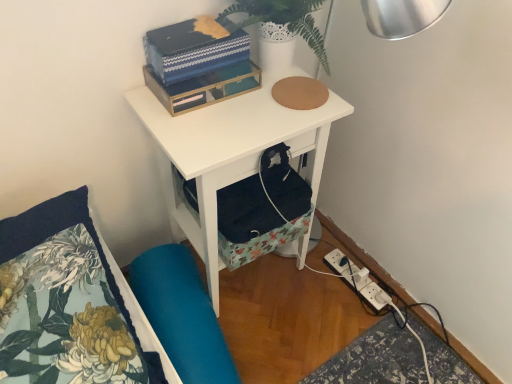
Question: Considering the relative positions of floral fabric pillow at lower left and blue textured box at upper center in the image provided, is floral fabric pillow at lower left to the right of blue textured box at upper center from the viewer's perspective?

Choices:
 (A) yes
 (B) no

Answer: (B)

Question: Does floral fabric pillow at lower left have a larger size compared to blue textured box at upper center?

Choices:
 (A) yes
 (B) no

Answer: (A)

Question: Is floral fabric pillow at lower left at the left side of blue textured box at upper center?

Choices:
 (A) yes
 (B) no

Answer: (A)

Question: Is blue textured box at upper center at the back of floral fabric pillow at lower left?

Choices:
 (A) yes
 (B) no

Answer: (B)

Question: Considering the relative sizes of floral fabric pillow at lower left and blue textured box at upper center in the image provided, is floral fabric pillow at lower left thinner than blue textured box at upper center?

Choices:
 (A) yes
 (B) no

Answer: (B)

Question: Is floral fabric pillow at lower left inside or outside of white textured vase at upper center?

Choices:
 (A) inside
 (B) outside

Answer: (B)

Question: Is point (22, 251) closer or farther from the camera than point (302, 13)?

Choices:
 (A) closer
 (B) farther

Answer: (A)

Question: Based on their positions, is floral fabric pillow at lower left located to the left or right of white textured vase at upper center?

Choices:
 (A) left
 (B) right

Answer: (A)

Question: From a real-world perspective, is floral fabric pillow at lower left above or below white textured vase at upper center?

Choices:
 (A) below
 (B) above

Answer: (A)

Question: Considering the positions of floral fabric pillow at lower left and white plastic power strip at lower right in the image, is floral fabric pillow at lower left taller or shorter than white plastic power strip at lower right?

Choices:
 (A) short
 (B) tall

Answer: (B)

Question: In the image, is floral fabric pillow at lower left positioned in front of or behind white plastic power strip at lower right?

Choices:
 (A) front
 (B) behind

Answer: (A)

Question: Considering the positions of floral fabric pillow at lower left and white plastic power strip at lower right in the image, is floral fabric pillow at lower left wider or thinner than white plastic power strip at lower right?

Choices:
 (A) thin
 (B) wide

Answer: (B)

Question: Would you say floral fabric pillow at lower left is to the left or to the right of white plastic power strip at lower right in the picture?

Choices:
 (A) right
 (B) left

Answer: (B)

Question: From a real-world perspective, is blue textured box at upper center positioned above or below floral fabric pillow at lower left?

Choices:
 (A) below
 (B) above

Answer: (B)

Question: Considering the positions of blue textured box at upper center and floral fabric pillow at lower left in the image, is blue textured box at upper center bigger or smaller than floral fabric pillow at lower left?

Choices:
 (A) big
 (B) small

Answer: (B)